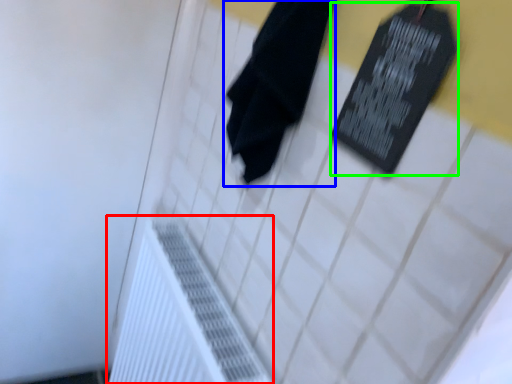
Question: Considering the real-world distances, which object is farthest from radiator (highlighted by a red box)? towel (highlighted by a blue box) or bulletin board (highlighted by a green box)?

Choices:
 (A) towel
 (B) bulletin board

Answer: (B)